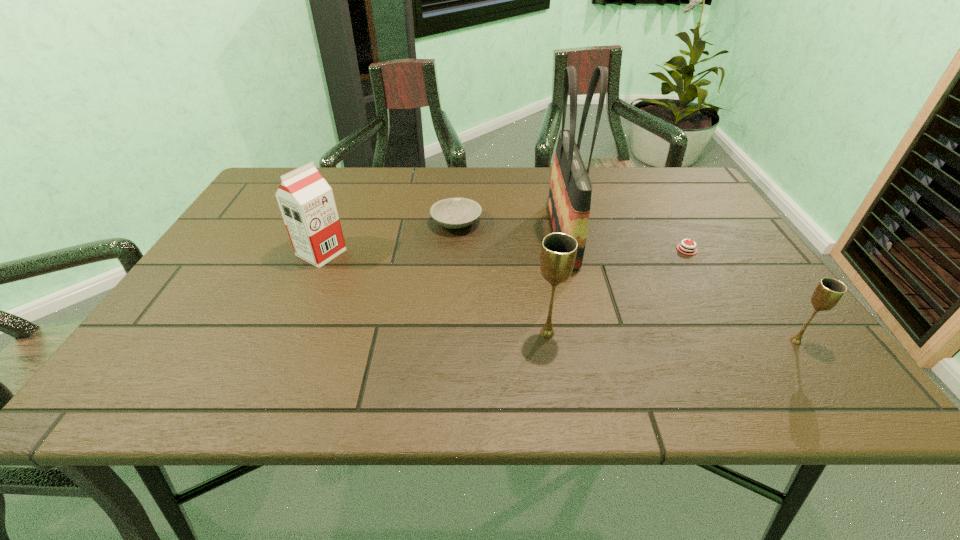
Please point a spot to add another chalice on the left. Please provide its 2D coordinates. Your answer should be formatted as a tuple, i.e. [(x, y)], where the tuple contains the x and y coordinates of a point satisfying the conditions above.

[(308, 325)]